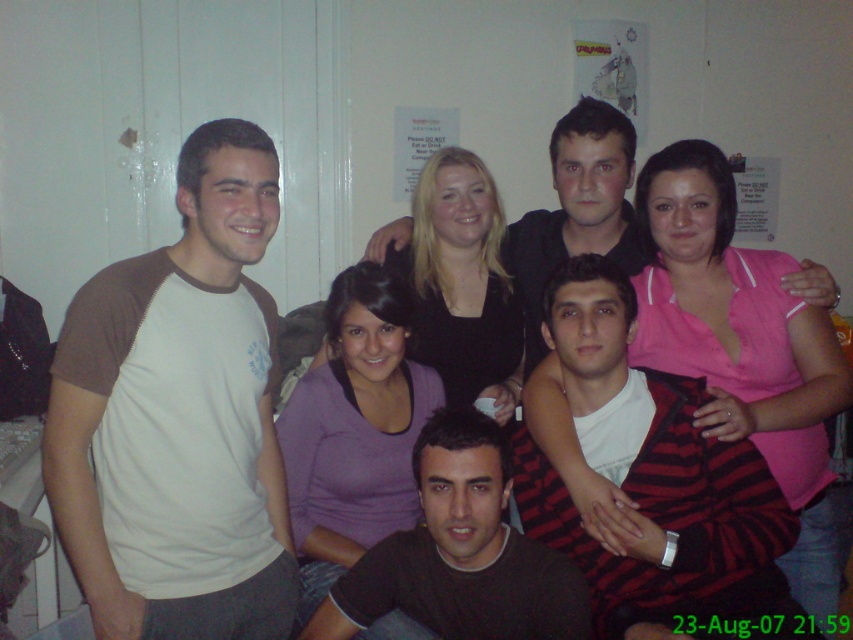
You are standing in the room and see the group of people. There is a point marked at coordinates (x=178, y=417). What is located at that point?

At point (x=178, y=417) lies the white cotton t shirt at left.